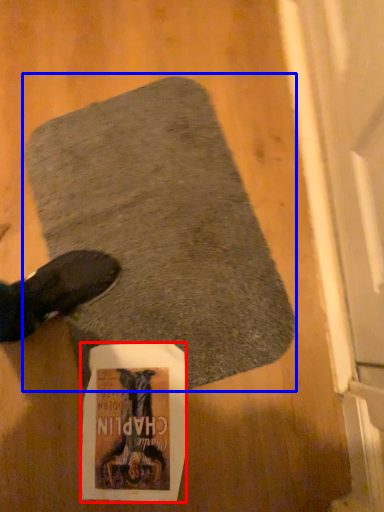
Question: Among these objects, which one is nearest to the camera, flyer (highlighted by a red box) or mat (highlighted by a blue box)?

Choices:
 (A) flyer
 (B) mat

Answer: (B)